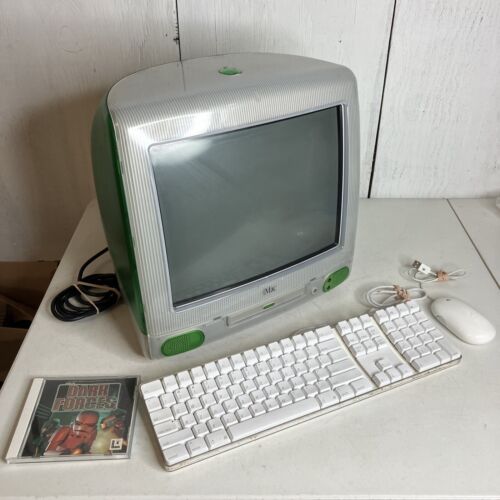
Find the location of `wall`. wall is located at coordinates (402, 109).